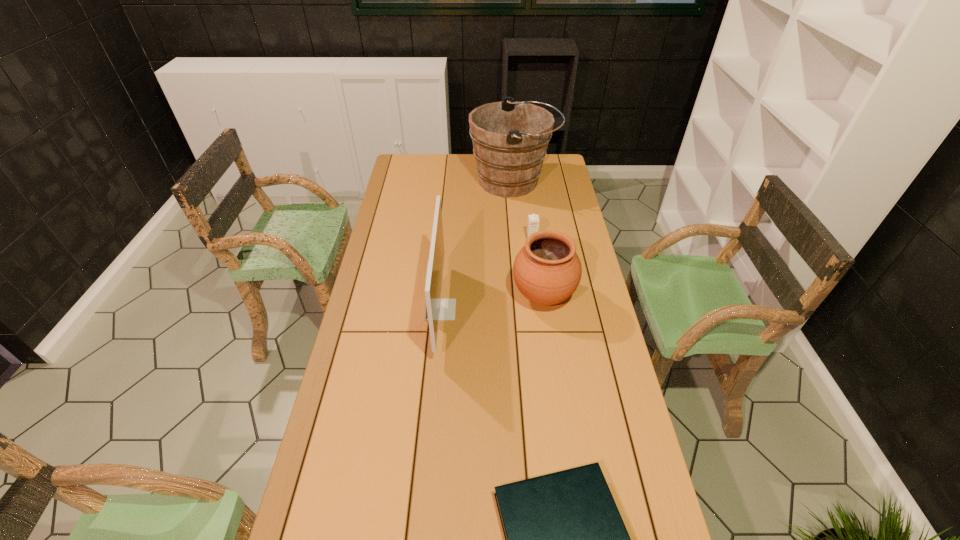
I want to click on pottery situated at the right edge, so click(547, 270).

Find the location of `object that is at the far right corner`. object that is at the far right corner is located at coordinates (510, 139).

At what (x,y) coordinates should I click in order to perform the action: click on free location at the far edge of the desktop. Please return your answer as a coordinate pair (x, y). Looking at the image, I should click on (461, 166).

At what (x,y) coordinates should I click in order to perform the action: click on vacant area at the left edge of the desktop. Please return your answer as a coordinate pair (x, y). Looking at the image, I should click on (412, 222).

The width and height of the screenshot is (960, 540). In the image, there is a desktop. What are the coordinates of `free space at the right edge` in the screenshot? It's located at (582, 262).

In the image, there is a desktop. Where is `vacant space at the far left corner`? vacant space at the far left corner is located at coordinates [406, 177].

The image size is (960, 540). In order to click on unoccupied area between the monitor and the third tallest object in this screenshot , I will do `click(492, 303)`.

Image resolution: width=960 pixels, height=540 pixels. I want to click on free space between the bucket and the chocolate milk, so click(x=522, y=211).

Find the location of a particular element. vacant area that lies between the farthest object and the fourth tallest object is located at coordinates (522, 211).

Where is `object that is the third closest to the pottery`? object that is the third closest to the pottery is located at coordinates [x=510, y=139].